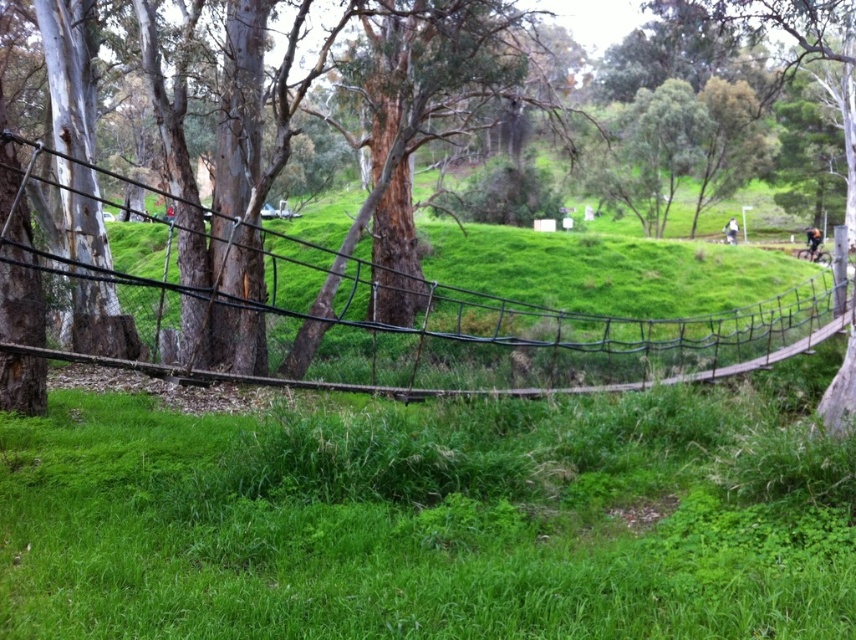
From the picture: You are standing on the suspension bridge and looking down. You see the green grassy at center and the black wire mesh at center below you. Which one is closer to your eyes?

The green grassy at center is closer to the viewer than the black wire mesh at center, so the green grassy at center is closer to your eyes.

You are a hiker standing on the suspension bridge and notice the green grassy at center and the black wire mesh at center. Which object is located below the other?

The green grassy at center is positioned under the black wire mesh at center, so the grass is below the wire mesh.